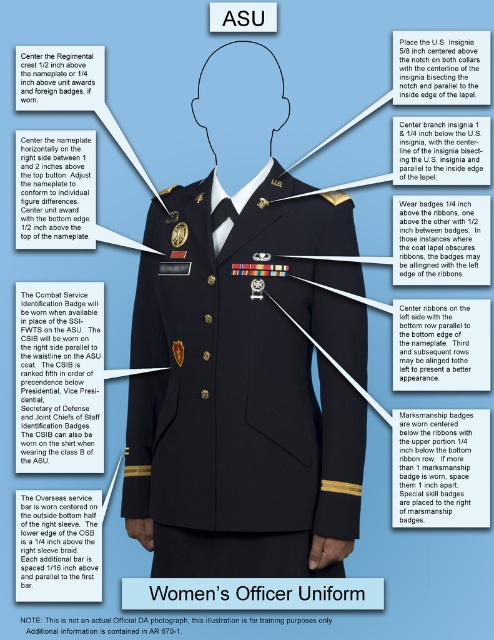
Which is behind, point (159, 596) or point (462, 33)?

Positioned behind is point (462, 33).

Consider the image. Who is taller, black fabric women's officer uniform at center or us insignia at upper center?

us insignia at upper center

This screenshot has width=494, height=640. In order to click on black fabric women's officer uniform at center in this screenshot , I will do `click(259, 593)`.

Measure the distance from center branch insignia at upper center to matte black nameplate at center.

The distance of center branch insignia at upper center from matte black nameplate at center is 39.03 inches.

Between center branch insignia at upper center and matte black nameplate at center, which one is positioned higher?

matte black nameplate at center is above.

Between point (417, 145) and point (54, 88), which one is positioned in front?

Positioned in front is point (54, 88).

The image size is (494, 640). Find the location of `center branch insignia at upper center`. center branch insignia at upper center is located at coordinates (441, 148).

Does navy blue wool jacket at center have a greater width compared to center branch insignia at upper center?

Correct, the width of navy blue wool jacket at center exceeds that of center branch insignia at upper center.

Can you confirm if navy blue wool jacket at center is taller than center branch insignia at upper center?

Indeed, navy blue wool jacket at center has a greater height compared to center branch insignia at upper center.

Which is behind, point (242, 483) or point (405, 173)?

Point (405, 173)

This screenshot has height=640, width=494. In order to click on navy blue wool jacket at center in this screenshot , I will do `click(237, 396)`.